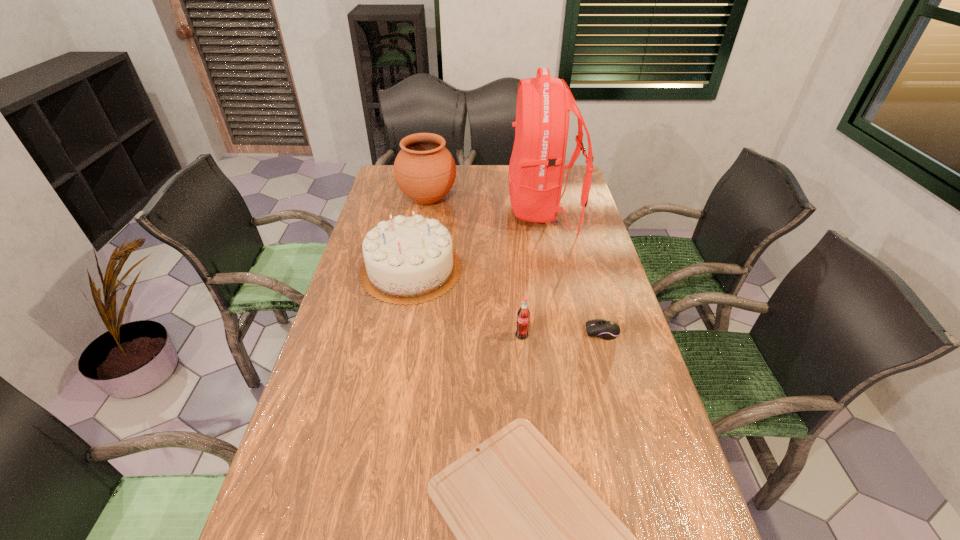
Identify the location of free spot located on the label of the soda bottle. (533, 453).

I want to click on free spot located 0.400m on the left of the computer mouse, so click(445, 332).

Where is `backpack that is at the far edge`? backpack that is at the far edge is located at coordinates click(537, 164).

Locate an element on the screen. pottery located at the far edge is located at coordinates (425, 171).

Identify the location of pottery present at the left edge. This screenshot has height=540, width=960. (425, 171).

This screenshot has height=540, width=960. I want to click on birthday cake positioned at the left edge, so click(x=407, y=260).

The image size is (960, 540). I want to click on backpack present at the right edge, so click(537, 164).

You are a GUI agent. You are given a task and a screenshot of the screen. Output one action in this format:
    pyautogui.click(x=<x>, y=<y>)
    Task: Click on the computer mouse that is at the right edge
    This screenshot has height=540, width=960.
    Given the screenshot: What is the action you would take?
    point(606,329)

Locate an element on the screen. object situated at the far left corner is located at coordinates (425, 171).

The width and height of the screenshot is (960, 540). Identify the location of object that is positioned at the far right corner. click(537, 164).